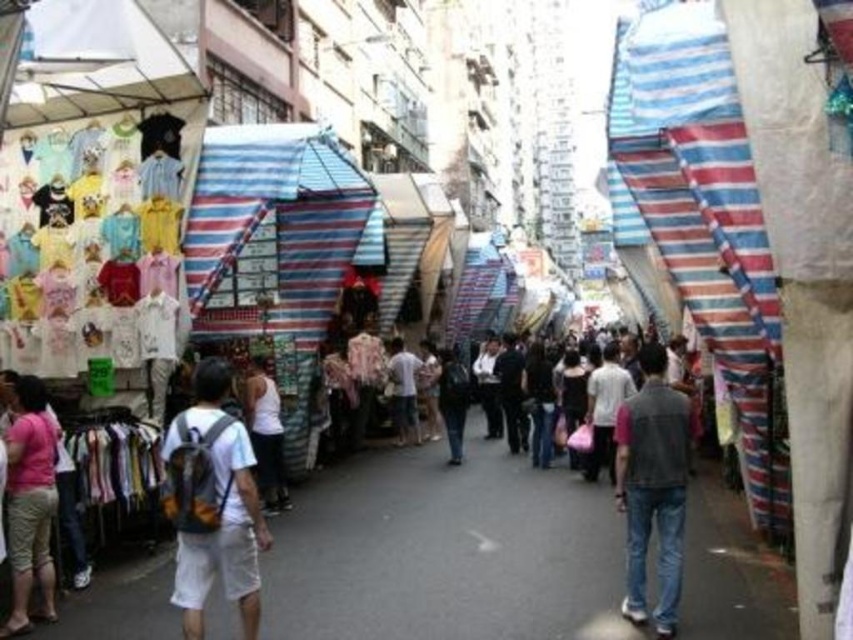
Can you confirm if denim jeans at center is positioned below pink fabric shorts at lower left?

Actually, denim jeans at center is above pink fabric shorts at lower left.

Describe the element at coordinates (653, 486) in the screenshot. I see `denim jeans at center` at that location.

The image size is (853, 640). What are the coordinates of `denim jeans at center` in the screenshot? It's located at (653, 486).

Can you confirm if white fabric backpack at center is positioned below pink fabric shorts at lower left?

Incorrect, white fabric backpack at center is not positioned below pink fabric shorts at lower left.

Is point (247, 502) more distant than point (15, 564)?

That is True.

This screenshot has width=853, height=640. I want to click on white fabric backpack at center, so click(224, 541).

Which is above, white fabric backpack at center or white matte tank top at center?

white matte tank top at center is higher up.

Can you confirm if white fabric backpack at center is taller than white matte tank top at center?

Yes.

At what (x,y) coordinates should I click in order to perform the action: click on white fabric backpack at center. Please return your answer as a coordinate pair (x, y). The image size is (853, 640). Looking at the image, I should click on (224, 541).